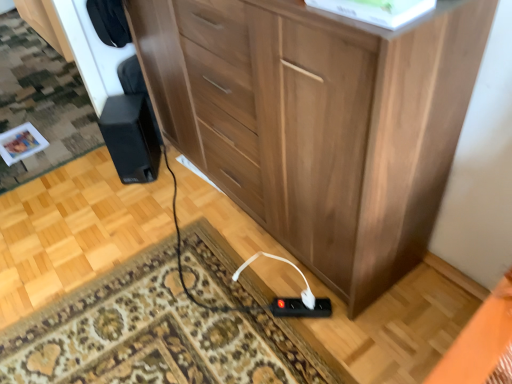
Question: Is black plastic power strip at lower center, positioned as the first plug in left-to-right order, bigger or smaller than black matte speaker at lower left?

Choices:
 (A) small
 (B) big

Answer: (A)

Question: In the image, is black plastic power strip at lower center, which is counted as the 2th plug, starting from the right, on the left side or the right side of black matte speaker at lower left?

Choices:
 (A) right
 (B) left

Answer: (A)

Question: Estimate the real-world distances between objects in this image. Which object is closer to the black matte speaker at lower left?

Choices:
 (A) black plastic power strip at lower center, positioned as the first plug in left-to-right order
 (B) white plastic plug at lower center, the first plug from the right

Answer: (A)

Question: Based on their relative distances, which object is nearer to the black matte speaker at lower left?

Choices:
 (A) white plastic plug at lower center, the first plug from the right
 (B) black plastic power strip at lower center, positioned as the first plug in left-to-right order

Answer: (B)